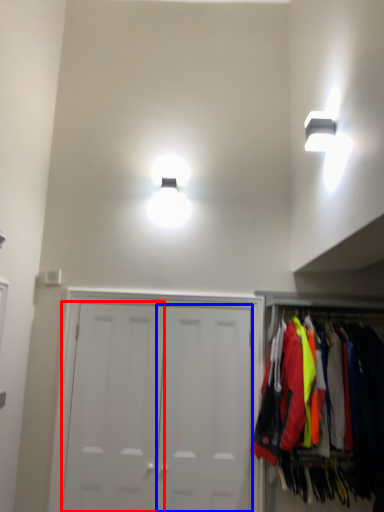
Question: Which object appears farthest to the camera in this image, door (highlighted by a red box) or door (highlighted by a blue box)?

Choices:
 (A) door
 (B) door

Answer: (A)